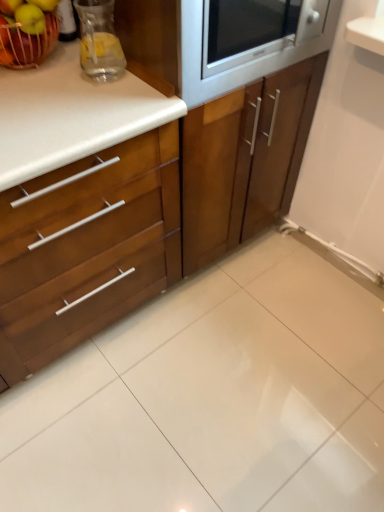
Question: From their relative heights in the image, would you say green matte apple at upper left, which appears as the 1th apple when viewed from the right, is taller or shorter than wooden cabinet at center, positioned as the 1th cabinetry in right-to-left order?

Choices:
 (A) short
 (B) tall

Answer: (A)

Question: From a real-world perspective, is green matte apple at upper left, placed as the second apple when sorted from left to right, above or below wooden cabinet at center, which is counted as the 2th cabinetry, starting from the left?

Choices:
 (A) below
 (B) above

Answer: (B)

Question: Which object is positioned closest to the clear glass pitcher at upper left?

Choices:
 (A) wooden cabinet at left, which appears as the 1th cabinetry when viewed from the left
 (B) satin silver microwave at upper center
 (C) white glossy ceramic tile at center
 (D) green matte apple at upper left, which appears as the 1th apple when viewed from the right
 (E) wooden cabinet at center, positioned as the 1th cabinetry in right-to-left order

Answer: (D)

Question: Which of these objects is positioned closest to the wooden cabinet at center, which is counted as the 2th cabinetry, starting from the left?

Choices:
 (A) shiny red apple at upper left, the 2th apple in the right-to-left sequence
 (B) white glossy ceramic tile at center
 (C) clear glass pitcher at upper left
 (D) green matte apple at upper left, placed as the second apple when sorted from left to right
 (E) satin silver microwave at upper center

Answer: (E)